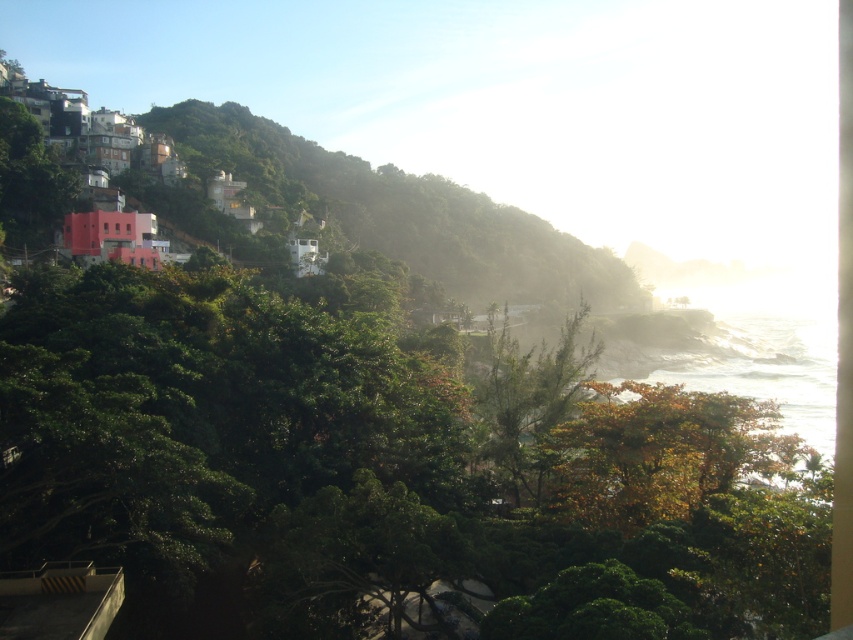
Which of these two, green leafy hillside at upper left or autumn leaves at center, stands taller?

green leafy hillside at upper left

Who is higher up, green leafy hillside at upper left or autumn leaves at center?

Positioned higher is green leafy hillside at upper left.

Find the location of `green leafy hillside at upper left`. green leafy hillside at upper left is located at coordinates (399, 212).

This screenshot has height=640, width=853. Identify the location of green leafy hillside at upper left. (399, 212).